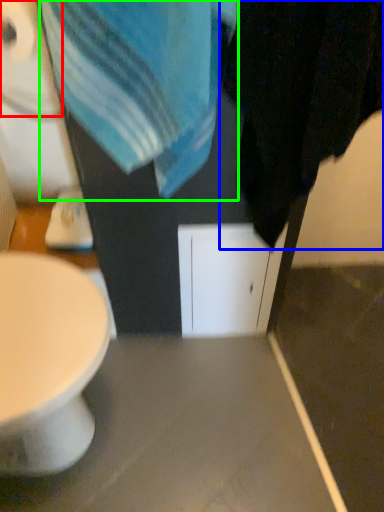
Question: Which is farther away from toilet paper (highlighted by a red box)? bath towel (highlighted by a blue box) or beach towel (highlighted by a green box)?

Choices:
 (A) bath towel
 (B) beach towel

Answer: (A)